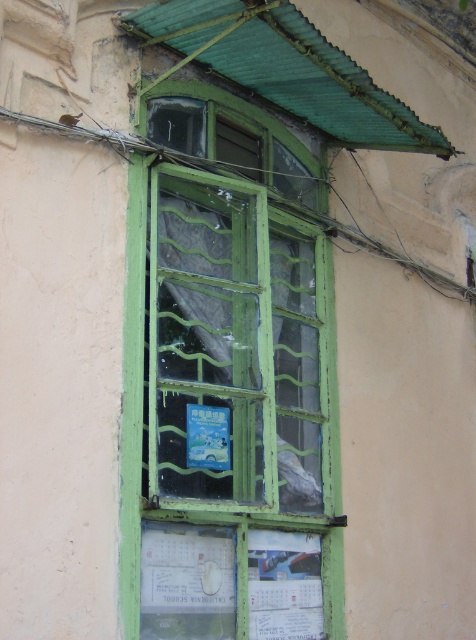
Could you measure the distance between green painted wood window frame at center and white paper calendar at lower center?

The distance of green painted wood window frame at center from white paper calendar at lower center is 18.74 inches.

What do you see at coordinates (228, 381) in the screenshot? This screenshot has width=476, height=640. I see `green painted wood window frame at center` at bounding box center [228, 381].

Where is `green painted wood window frame at center`? green painted wood window frame at center is located at coordinates (228, 381).